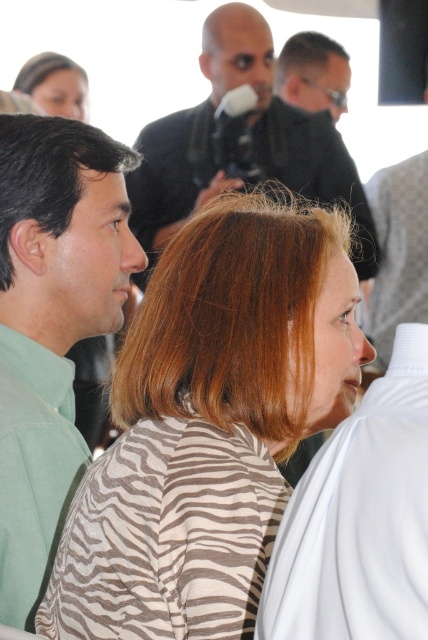
Can you confirm if dark brown hair at left is thinner than zebra print scarf at upper left?

Indeed, dark brown hair at left has a lesser width compared to zebra print scarf at upper left.

Can you confirm if dark brown hair at left is positioned below zebra print scarf at upper left?

Yes, dark brown hair at left is below zebra print scarf at upper left.

Does point (5, 172) come behind point (29, 83)?

No, it is in front of (29, 83).

Locate an element on the screen. Image resolution: width=428 pixels, height=640 pixels. dark brown hair at left is located at coordinates (48, 172).

Is green matte shirt at left to the left of zebra print scarf at upper left from the viewer's perspective?

In fact, green matte shirt at left is to the right of zebra print scarf at upper left.

How distant is green matte shirt at left from zebra print scarf at upper left?

green matte shirt at left is 3.12 meters away from zebra print scarf at upper left.

Who is more distant from viewer, [71,458] or [39,61]?

Positioned behind is point [39,61].

You are a GUI agent. You are given a task and a screenshot of the screen. Output one action in this format:
    pyautogui.click(x=<x>, y=<y>)
    Task: Click on the green matte shirt at left
    
    Given the screenshot: What is the action you would take?
    pyautogui.click(x=50, y=323)

Does point (262, 234) come farther from viewer compared to point (32, 58)?

No, it is in front of (32, 58).

Identify the location of zebra-patterned sweater at center. (208, 426).

I want to click on zebra-patterned sweater at center, so [x=208, y=426].